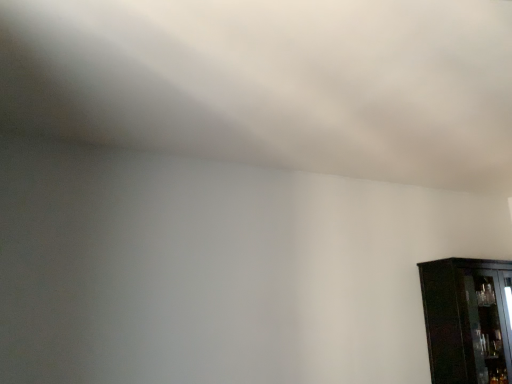
Where is `white matte cloud at upper center`? white matte cloud at upper center is located at coordinates (273, 82).

Image resolution: width=512 pixels, height=384 pixels. What do you see at coordinates (273, 82) in the screenshot? I see `white matte cloud at upper center` at bounding box center [273, 82].

What is the approximate width of white matte cloud at upper center?

4.20 meters.

Where is `white matte cloud at upper center`? white matte cloud at upper center is located at coordinates (273, 82).